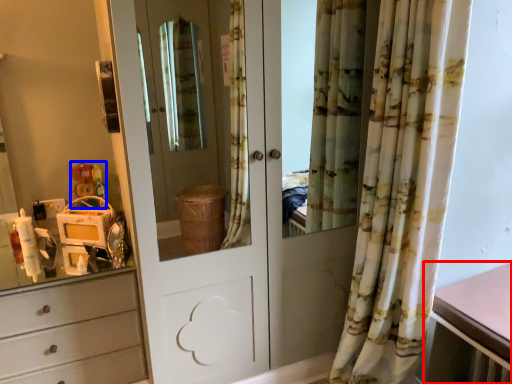
Question: Among these objects, which one is nearest to the camera, table (highlighted by a red box) or toy (highlighted by a blue box)?

Choices:
 (A) table
 (B) toy

Answer: (A)